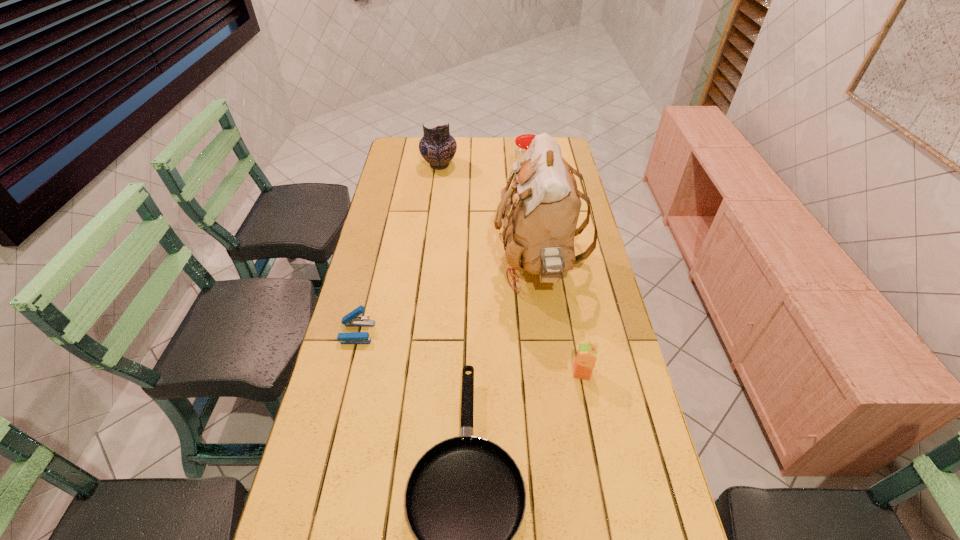
You are a GUI agent. You are given a task and a screenshot of the screen. Output one action in this format:
    pyautogui.click(x=<x>, y=<y>)
    Task: Click on the tallest object
    
    Given the screenshot: What is the action you would take?
    pyautogui.click(x=539, y=213)

Find the location of a particular element. This screenshot has height=540, width=960. backpack is located at coordinates (539, 213).

Identify the location of pottery. The height and width of the screenshot is (540, 960). point(437,146).

This screenshot has height=540, width=960. Identify the location of jar. (523, 142).

You are a GUI agent. You are given a task and a screenshot of the screen. Output one action in this format:
    pyautogui.click(x=<x>, y=<y>)
    Task: Click on the third shortest object
    The image size is (960, 540).
    Given the screenshot: What is the action you would take?
    pyautogui.click(x=586, y=357)

Identify the location of stapler. (351, 319).

The height and width of the screenshot is (540, 960). What are the coordinates of `the leftmost object` in the screenshot? It's located at (351, 319).

Where is `vacant space located on the front-facing side of the backpack`? The image size is (960, 540). vacant space located on the front-facing side of the backpack is located at coordinates (468, 266).

Locate an element on the screen. The width and height of the screenshot is (960, 540). free space located on the front-facing side of the backpack is located at coordinates (444, 266).

You are a GUI agent. You are given a task and a screenshot of the screen. Output one action in this format:
    pyautogui.click(x=<x>, y=<y>)
    Task: Click on the free space located 0.110m on the front-facing side of the backpack
    
    Given the screenshot: What is the action you would take?
    pyautogui.click(x=460, y=266)